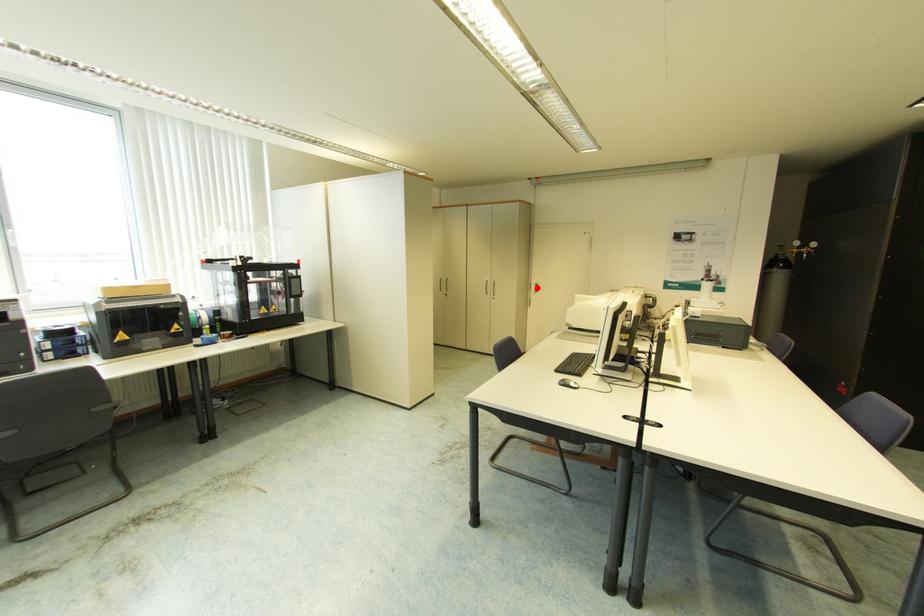
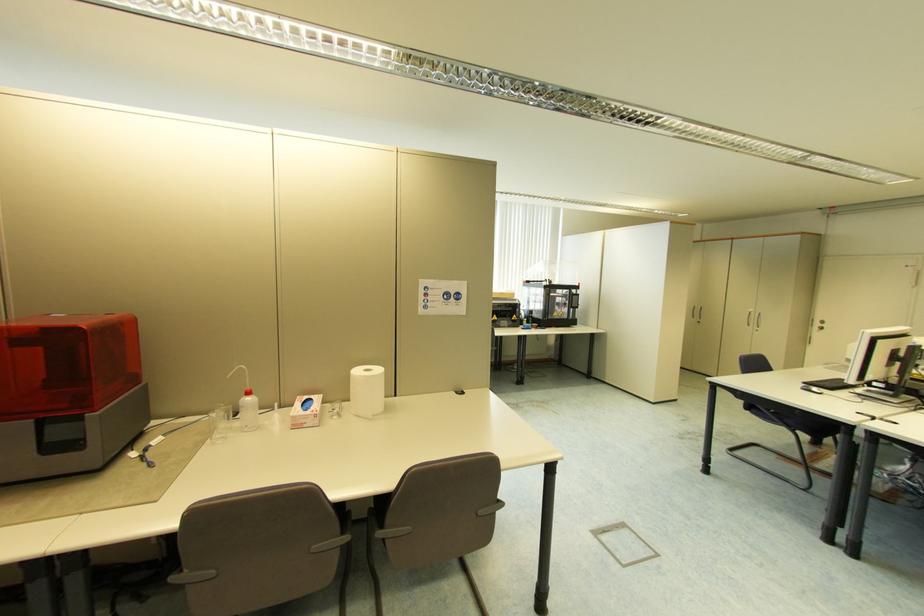
Question: I am providing you with two images of the same scene from different viewpoints. Image1 has a red point marked. In image2, the corresponding 3D location appears at what relative position? Reply with the corresponding letter.

Choices:
 (A) Closer
 (B) Farther

Answer: (B)